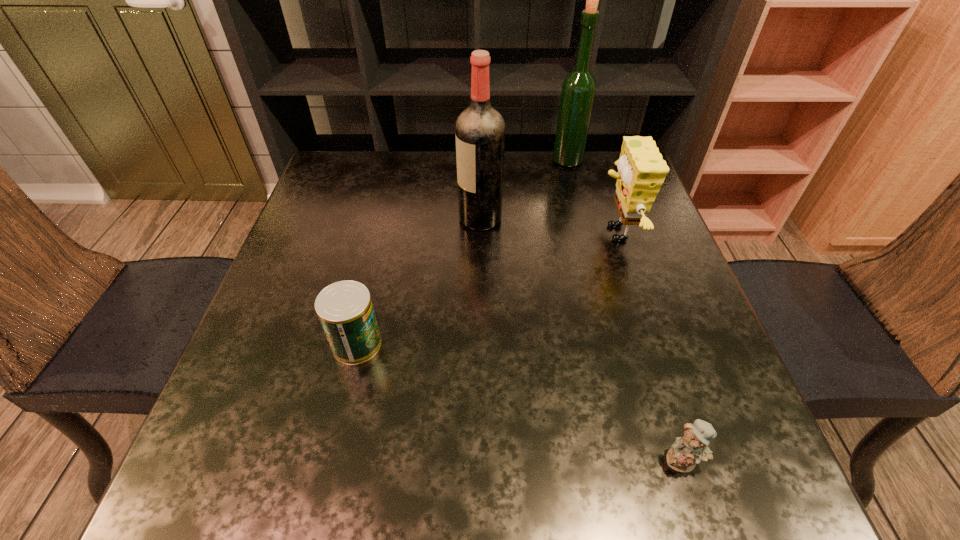
The height and width of the screenshot is (540, 960). Identify the location of sponge that is at the right edge. (641, 169).

This screenshot has width=960, height=540. Find the location of `teddy bear that is at the right edge`. teddy bear that is at the right edge is located at coordinates (692, 448).

You are a GUI agent. You are given a task and a screenshot of the screen. Output one action in this format:
    pyautogui.click(x=<x>, y=<y>)
    Task: Click on the object positioned at the far right corner
    
    Given the screenshot: What is the action you would take?
    pyautogui.click(x=578, y=90)

This screenshot has height=540, width=960. Identify the location of object present at the near right corner. (692, 448).

This screenshot has width=960, height=540. I want to click on free space at the far edge of the desktop, so click(x=385, y=164).

This screenshot has height=540, width=960. What are the coordinates of `free space at the near edge` in the screenshot? It's located at (495, 482).

What are the coordinates of `vacant space at the left edge of the desktop` in the screenshot? It's located at click(298, 433).

In the image, there is a desktop. Where is `free space at the right edge`? The image size is (960, 540). free space at the right edge is located at coordinates (715, 415).

In the image, there is a desktop. At what (x,y) coordinates should I click in order to perform the action: click on vacant space at the far left corner. Please return your answer as a coordinate pair (x, y). Looking at the image, I should click on (339, 183).

Find the location of a particular element. The height and width of the screenshot is (540, 960). free point at the near right corner is located at coordinates (779, 495).